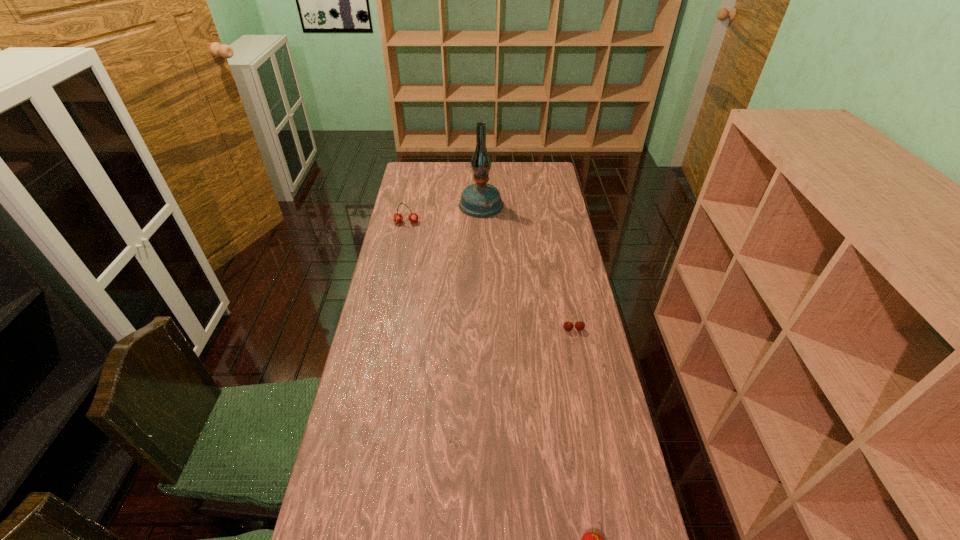
At what (x,y) coordinates should I click in order to perform the action: click on vacant space that's between the farthest object and the shortest cherry. Please return your answer as a coordinate pair (x, y). This screenshot has height=540, width=960. Looking at the image, I should click on tap(527, 267).

Find the location of a particular element. This screenshot has width=960, height=540. vacant space that's between the leftmost cherry and the third object from right to left is located at coordinates (444, 213).

Point out which object is positioned as the second nearest to the second farthest object. Please provide its 2D coordinates. Your answer should be formatted as a tuple, i.e. [(x, y)], where the tuple contains the x and y coordinates of a point satisfying the conditions above.

[(568, 326)]

Locate which object is the third closest to the shortest object. Please provide its 2D coordinates. Your answer should be formatted as a tuple, i.e. [(x, y)], where the tuple contains the x and y coordinates of a point satisfying the conditions above.

[(413, 217)]

At what (x,y) coordinates should I click in order to perform the action: click on the closest cherry to the shortest object. Please return your answer as a coordinate pair (x, y). This screenshot has height=540, width=960. Looking at the image, I should click on (591, 539).

Point out which cherry is positioned as the second nearest to the shortest object. Please provide its 2D coordinates. Your answer should be formatted as a tuple, i.e. [(x, y)], where the tuple contains the x and y coordinates of a point satisfying the conditions above.

[(413, 217)]